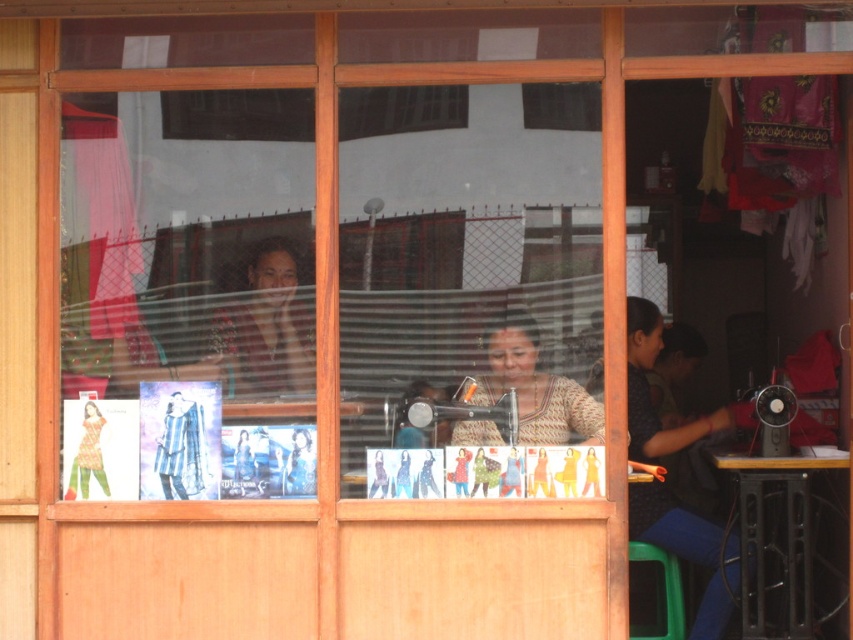
Who is higher up, dark blue fabric at lower right or matte brown shirt at center?

matte brown shirt at center is above.

Is the position of dark blue fabric at lower right more distant than that of matte brown shirt at center?

Yes.

Does point (683, 538) come behind point (247, 392)?

Yes, it is.

Locate an element on the screen. The height and width of the screenshot is (640, 853). dark blue fabric at lower right is located at coordinates (689, 550).

Consider the image. Is dark blue fabric at lower right wider than printed cotton dress at center?

Yes, dark blue fabric at lower right is wider than printed cotton dress at center.

Is point (723, 604) positioned after point (84, 468)?

Yes, point (723, 604) is farther from viewer.

What do you see at coordinates (689, 550) in the screenshot? I see `dark blue fabric at lower right` at bounding box center [689, 550].

The height and width of the screenshot is (640, 853). I want to click on dark blue fabric at lower right, so click(689, 550).

Between matte brown shirt at center and knitted beige sweater at center, which one is positioned lower?

knitted beige sweater at center is lower down.

Who is more forward, (262,387) or (561,403)?

Positioned in front is point (561,403).

Between point (254, 385) and point (492, 369), which one is positioned behind?

The point (254, 385) is behind.

Image resolution: width=853 pixels, height=640 pixels. I want to click on matte brown shirt at center, so click(x=264, y=330).